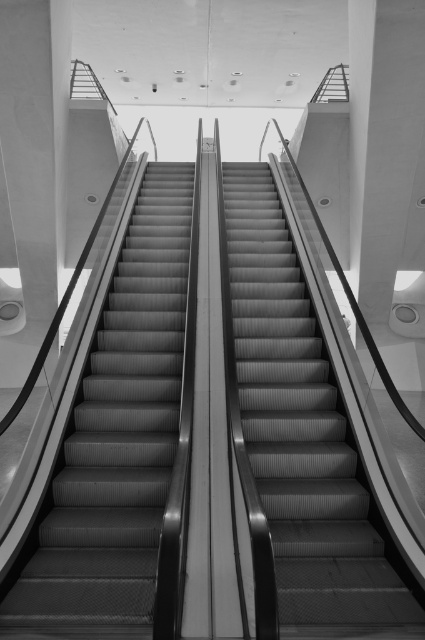
You are standing on the platform above the two escalators. You need to take the one that is to the right. Which one should you choose between the metallic gray stairs at left and the metallic gray escalator at center?

The metallic gray escalator at center is to the right of the metallic gray stairs at left, so you should choose the metallic gray escalator at center.